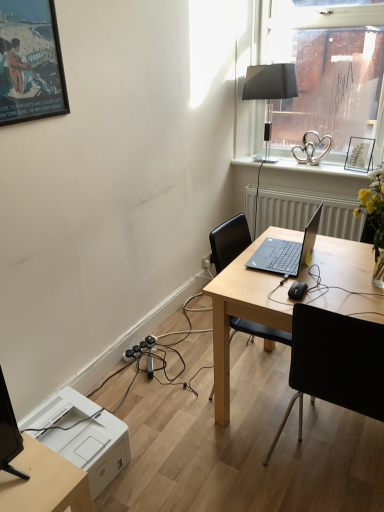
Question: Would you consider transparent glass window at upper right to be distant from black plastic mouse at lower right?

Choices:
 (A) yes
 (B) no

Answer: (A)

Question: Would you say transparent glass window at upper right contains black plastic mouse at lower right?

Choices:
 (A) yes
 (B) no

Answer: (B)

Question: Considering the relative sizes of transparent glass window at upper right and black plastic mouse at lower right in the image provided, is transparent glass window at upper right thinner than black plastic mouse at lower right?

Choices:
 (A) yes
 (B) no

Answer: (B)

Question: From a real-world perspective, is transparent glass window at upper right positioned over black plastic mouse at lower right based on gravity?

Choices:
 (A) yes
 (B) no

Answer: (A)

Question: Is black plastic mouse at lower right at the back of transparent glass window at upper right?

Choices:
 (A) yes
 (B) no

Answer: (B)

Question: Can you confirm if transparent glass window at upper right is bigger than black plastic mouse at lower right?

Choices:
 (A) yes
 (B) no

Answer: (A)

Question: Is transparent glass window at upper right at the back of light wood desk at center?

Choices:
 (A) yes
 (B) no

Answer: (B)

Question: From a real-world perspective, is light wood desk at center on transparent glass window at upper right?

Choices:
 (A) yes
 (B) no

Answer: (B)

Question: Can you confirm if light wood desk at center is smaller than transparent glass window at upper right?

Choices:
 (A) yes
 (B) no

Answer: (B)

Question: Does light wood desk at center come in front of transparent glass window at upper right?

Choices:
 (A) no
 (B) yes

Answer: (B)

Question: From a real-world perspective, is light wood desk at center physically below transparent glass window at upper right?

Choices:
 (A) no
 (B) yes

Answer: (B)

Question: From the image's perspective, does light wood desk at center appear higher than transparent glass window at upper right?

Choices:
 (A) no
 (B) yes

Answer: (A)

Question: Can you confirm if matte black picture frame at upper right, the second picture frame from the left, is smaller than light wood desk at center?

Choices:
 (A) no
 (B) yes

Answer: (B)